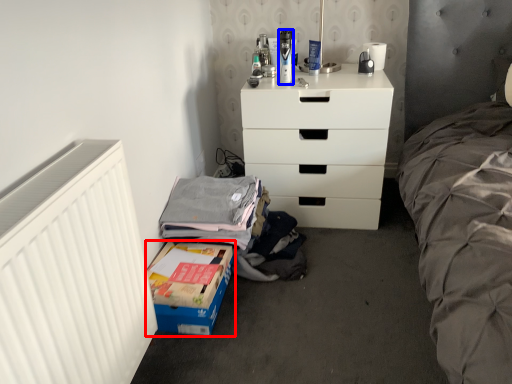
Question: Which object appears farthest to the camera in this image, box (highlighted by a red box) or toiletry (highlighted by a blue box)?

Choices:
 (A) box
 (B) toiletry

Answer: (B)